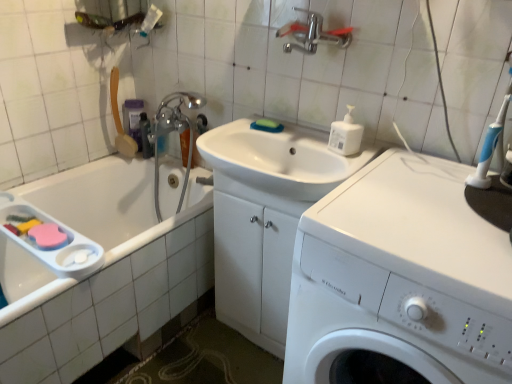
At what (x,y) coordinates should I click in order to perform the action: click on vacant area on top of white plastic washing machine at center (from a real-world perspective). Please return your answer as a coordinate pair (x, y). The height and width of the screenshot is (384, 512). Looking at the image, I should click on (435, 208).